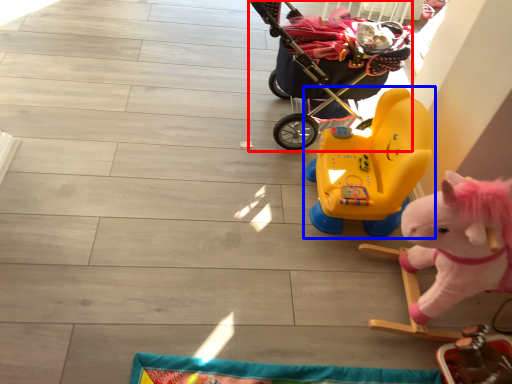
Question: Which object is closer to the camera taking this photo, baby carriage (highlighted by a red box) or toy (highlighted by a blue box)?

Choices:
 (A) baby carriage
 (B) toy

Answer: (B)